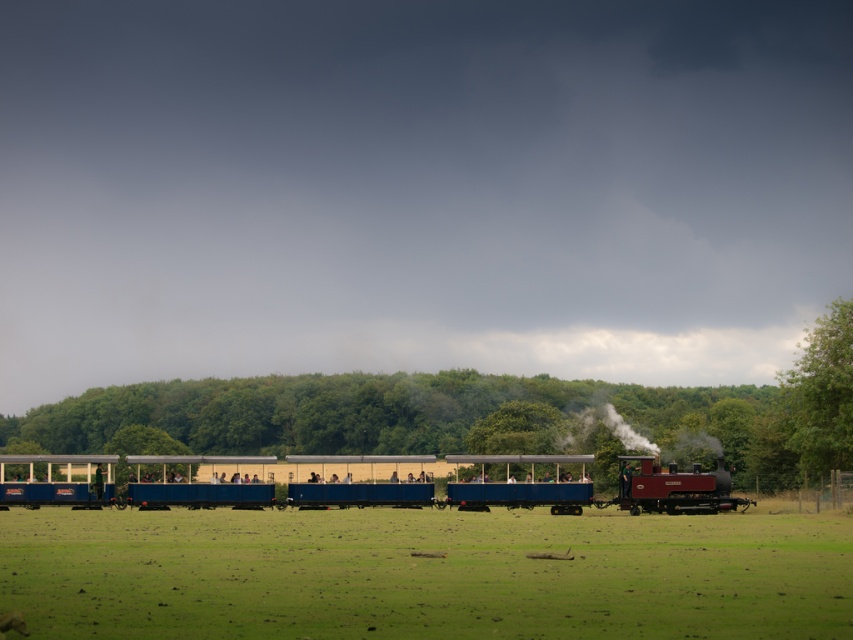
Question: Can you confirm if blue painted wood train at center is positioned below green leafy tree at right?

Choices:
 (A) yes
 (B) no

Answer: (A)

Question: Which object is closer to the camera taking this photo?

Choices:
 (A) blue painted wood train at center
 (B) polished wood steam engine at center
 (C) green leafy tree at right

Answer: (A)

Question: Which object is the farthest from the green grass at lower center?

Choices:
 (A) green leafy tree at right
 (B) polished wood steam engine at center

Answer: (B)

Question: Is green grass at lower center to the right of green leafy tree at right from the viewer's perspective?

Choices:
 (A) no
 (B) yes

Answer: (A)

Question: Does green grass at lower center appear on the right side of blue painted wood train at center?

Choices:
 (A) no
 (B) yes

Answer: (B)

Question: Which point is farther to the camera?

Choices:
 (A) blue painted wood train at center
 (B) polished wood steam engine at center
 (C) green leafy tree at right
 (D) green grass at lower center

Answer: (C)